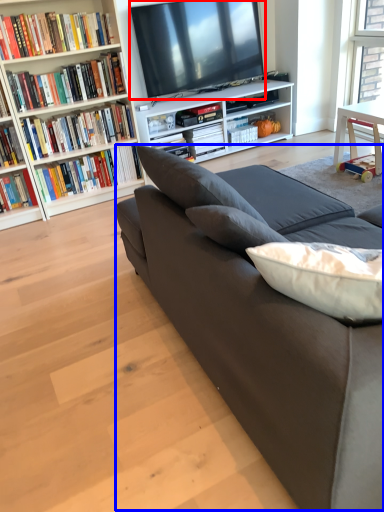
Question: Which of the following is the closest to the observer, television (highlighted by a red box) or couch (highlighted by a blue box)?

Choices:
 (A) television
 (B) couch

Answer: (B)